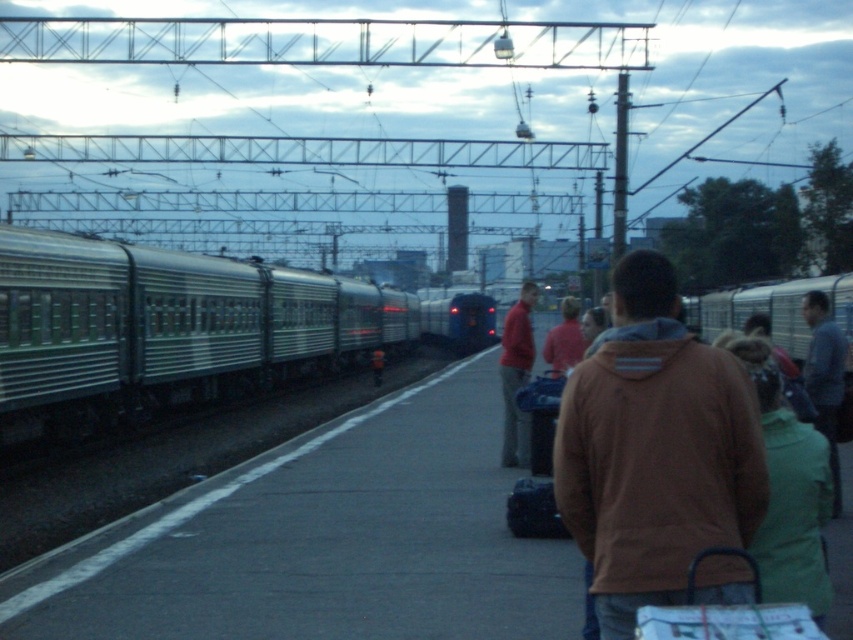
Can you confirm if green metallic train at left is shorter than dark gray metallic train at center?

Yes.

Where is `green metallic train at left`? The image size is (853, 640). green metallic train at left is located at coordinates (164, 330).

Who is more distant from viewer, (177, 280) or (422, 330)?

The point (422, 330) is behind.

Locate an element on the screen. This screenshot has height=640, width=853. green metallic train at left is located at coordinates (164, 330).

Consider the image. Measure the distance between green metallic train at left and camera.

They are 15.33 meters apart.

Describe the element at coordinates (164, 330) in the screenshot. I see `green metallic train at left` at that location.

Which is behind, point (74, 368) or point (614, 365)?

The point (74, 368) is behind.

Find the location of a particular element. The image size is (853, 640). green metallic train at left is located at coordinates (164, 330).

Does brown hoodie at center lie behind dark gray metallic train at center?

No, brown hoodie at center is in front of dark gray metallic train at center.

The height and width of the screenshot is (640, 853). What do you see at coordinates (654, 449) in the screenshot?
I see `brown hoodie at center` at bounding box center [654, 449].

Locate an element on the screen. The image size is (853, 640). brown hoodie at center is located at coordinates (654, 449).